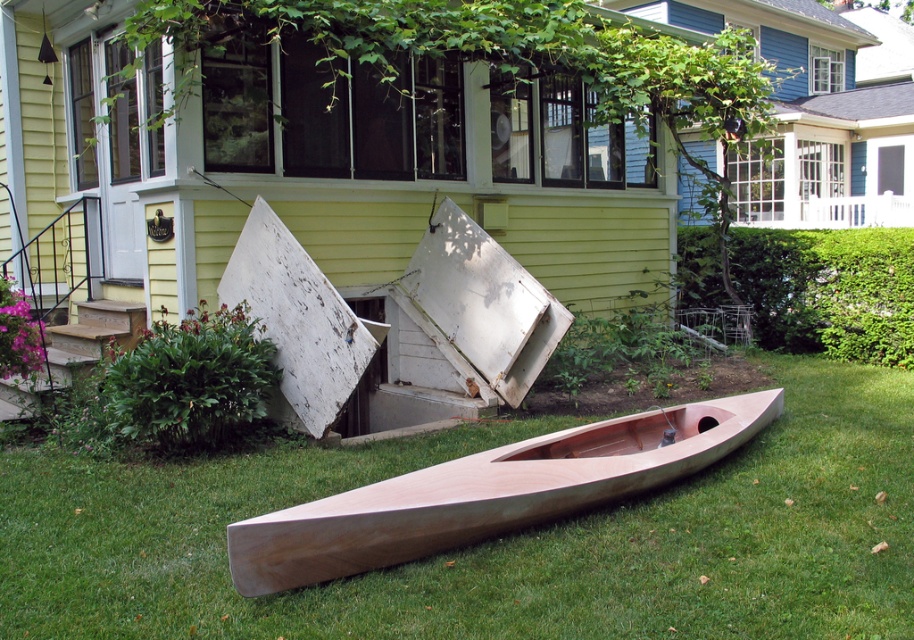
Which of these two, green grass at lower center or wooden canoe at center, stands taller?

Standing taller between the two is wooden canoe at center.

Can you confirm if green grass at lower center is taller than wooden canoe at center?

In fact, green grass at lower center may be shorter than wooden canoe at center.

You are a GUI agent. You are given a task and a screenshot of the screen. Output one action in this format:
    pyautogui.click(x=<x>, y=<y>)
    Task: Click on the green grass at lower center
    
    Given the screenshot: What is the action you would take?
    click(x=494, y=538)

The width and height of the screenshot is (914, 640). In order to click on green grass at lower center in this screenshot , I will do `click(494, 538)`.